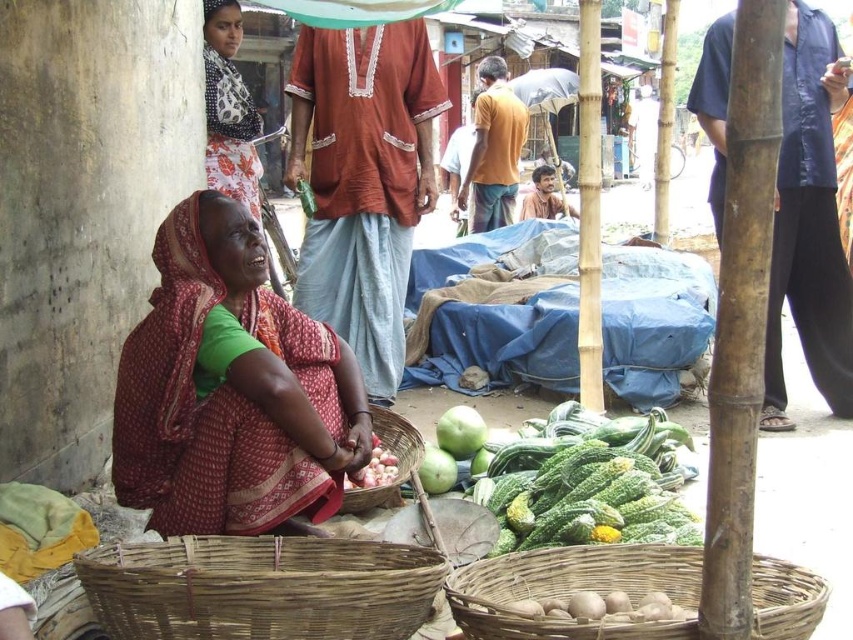
Question: Which of the following is the closest to the observer?

Choices:
 (A) brown textured shirt at center
 (B) matte orange shirt at center
 (C) printed cotton saree at upper left

Answer: (B)

Question: Does woven brown basket at center have a lesser width compared to green matte gourd at center?

Choices:
 (A) yes
 (B) no

Answer: (B)

Question: Which point appears closest to the camera in this image?

Choices:
 (A) (474, 440)
 (B) (520, 611)

Answer: (B)

Question: Does matte orange shirt at center come in front of smooth brown potatoes at lower center?

Choices:
 (A) yes
 (B) no

Answer: (B)

Question: Which object appears farthest from the camera in this image?

Choices:
 (A) matte orange shirt at center
 (B) green matte gourd at center

Answer: (A)

Question: Can you confirm if reddish-brown fabric at center is positioned below woven brown basket at center?

Choices:
 (A) no
 (B) yes

Answer: (A)